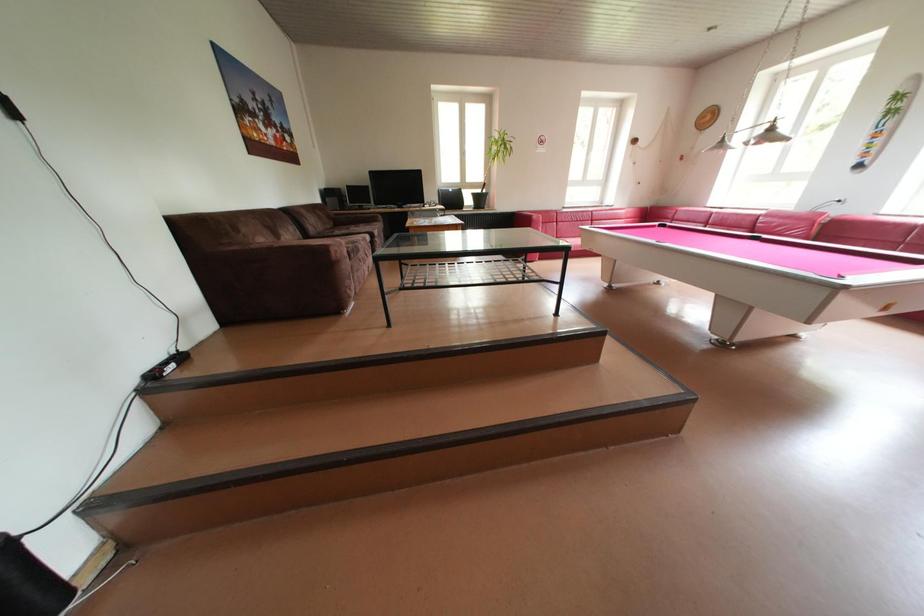
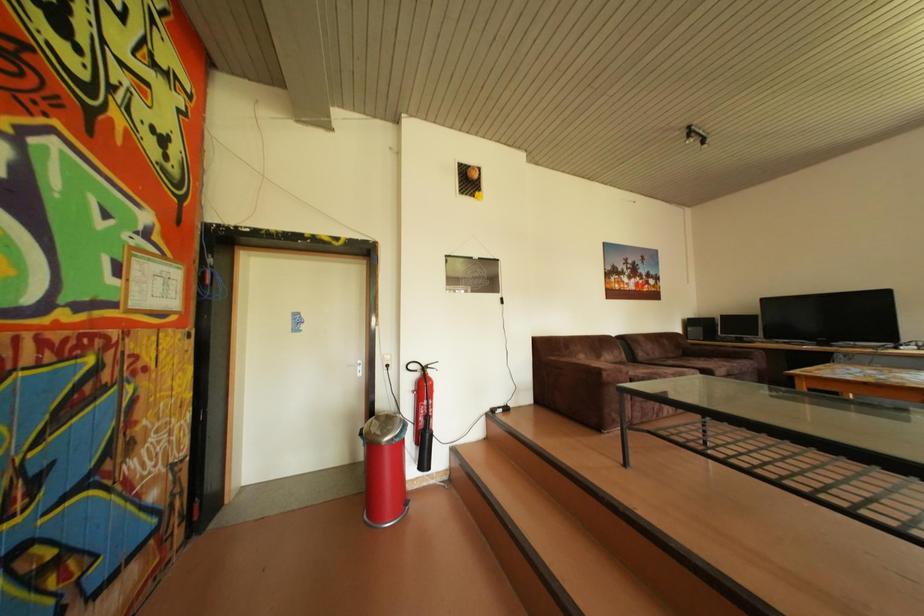
Question: The first image is from the beginning of the video and the second image is from the end. How did the camera likely rotate when shooting the video?

Choices:
 (A) Left
 (B) Right
 (C) Up
 (D) Down

Answer: (A)